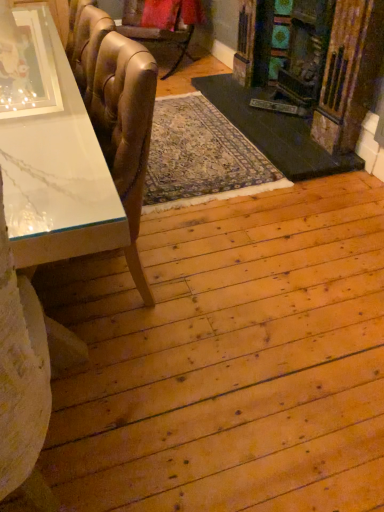
Question: Does wooden fireplace at right appear on the left side of white marble table at left?

Choices:
 (A) no
 (B) yes

Answer: (A)

Question: Is wooden fireplace at right not within white marble table at left?

Choices:
 (A) no
 (B) yes

Answer: (B)

Question: Does wooden fireplace at right have a larger size compared to white marble table at left?

Choices:
 (A) no
 (B) yes

Answer: (A)

Question: Does wooden fireplace at right lie in front of white marble table at left?

Choices:
 (A) no
 (B) yes

Answer: (A)

Question: Can you confirm if wooden fireplace at right is taller than white marble table at left?

Choices:
 (A) no
 (B) yes

Answer: (B)

Question: Is wooden fireplace at right positioned far away from white marble table at left?

Choices:
 (A) yes
 (B) no

Answer: (A)

Question: From the image's perspective, is leather-like gold chair at upper left, marked as the first chair in a top-to-bottom arrangement, under wooden fireplace at right?

Choices:
 (A) no
 (B) yes

Answer: (A)

Question: Is leather-like gold chair at upper left, positioned as the first chair in back-to-front order, surrounding wooden fireplace at right?

Choices:
 (A) yes
 (B) no

Answer: (B)

Question: Is leather-like gold chair at upper left, positioned as the first chair in back-to-front order, positioned with its back to wooden fireplace at right?

Choices:
 (A) yes
 (B) no

Answer: (B)

Question: Considering the relative sizes of leather-like gold chair at upper left, positioned as the first chair in back-to-front order, and wooden fireplace at right in the image provided, is leather-like gold chair at upper left, positioned as the first chair in back-to-front order, smaller than wooden fireplace at right?

Choices:
 (A) yes
 (B) no

Answer: (A)

Question: From a real-world perspective, is leather-like gold chair at upper left, which ranks as the second chair in bottom-to-top order, physically below wooden fireplace at right?

Choices:
 (A) yes
 (B) no

Answer: (A)

Question: Can we say leather-like gold chair at upper left, which ranks as the second chair in bottom-to-top order, lies outside wooden fireplace at right?

Choices:
 (A) no
 (B) yes

Answer: (B)

Question: Considering the relative sizes of leather-like gold chair at upper left, acting as the second chair starting from the front, and white marble table at left in the image provided, is leather-like gold chair at upper left, acting as the second chair starting from the front, shorter than white marble table at left?

Choices:
 (A) yes
 (B) no

Answer: (A)